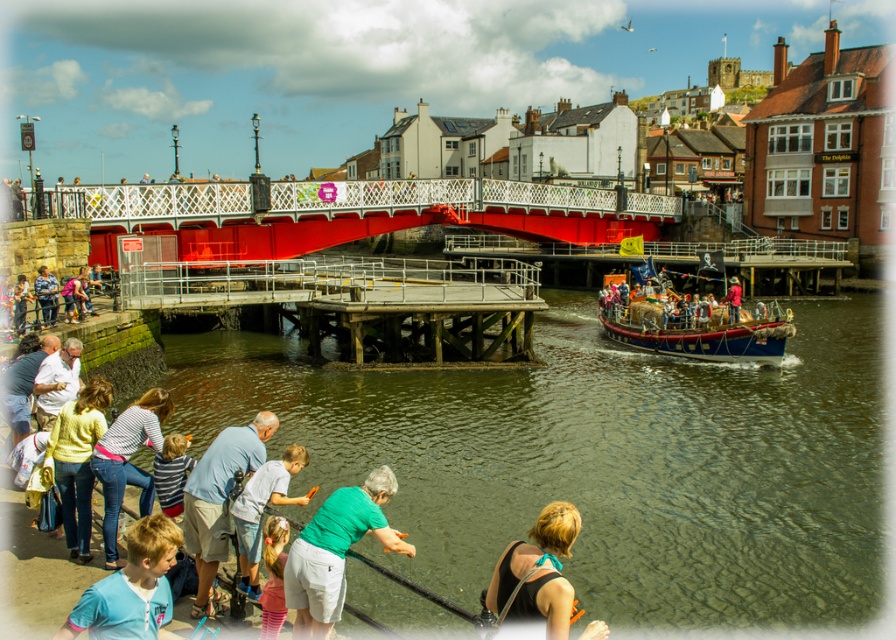
You are a photographer standing at the riverside and want to capture a photo of the jeans at lower left and the matte blue shirt at lower center. Which of the two items should you focus on first if you want to ensure both are in the frame without moving the camera?

You should focus on the jeans at lower left first because it is taller than the matte blue shirt at lower center, so adjusting the camera angle to include its height will naturally include the shorter item as well.